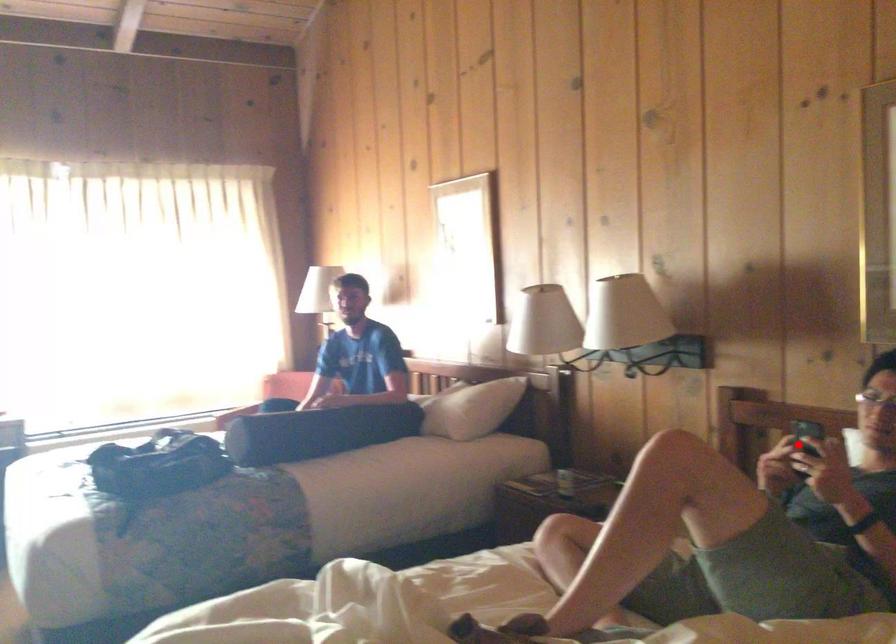
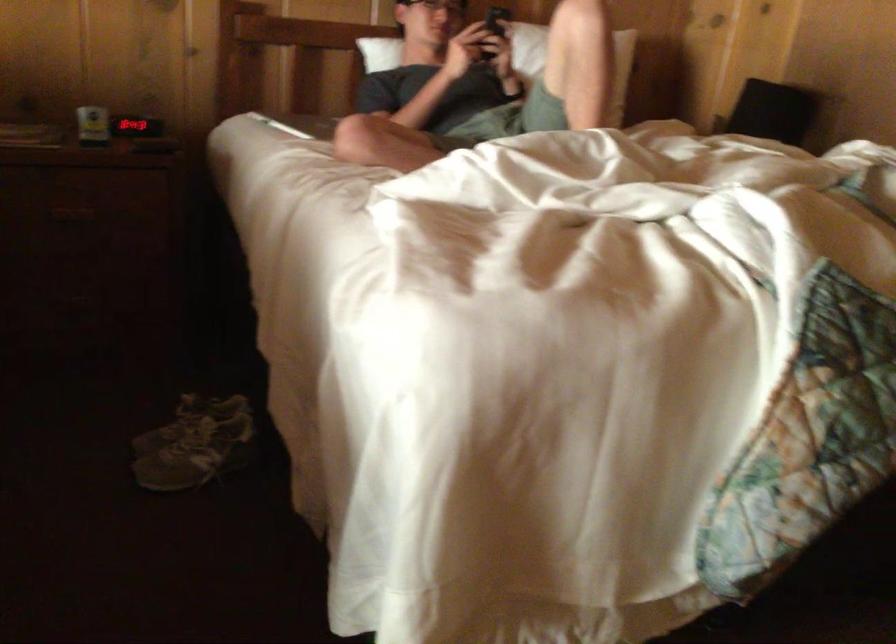
Question: I am providing you with two images of the same scene from different viewpoints. Given a red point in image1, look at the same physical point in image2. Is it:

Choices:
 (A) Closer to the viewpoint
 (B) Farther from the viewpoint

Answer: (B)